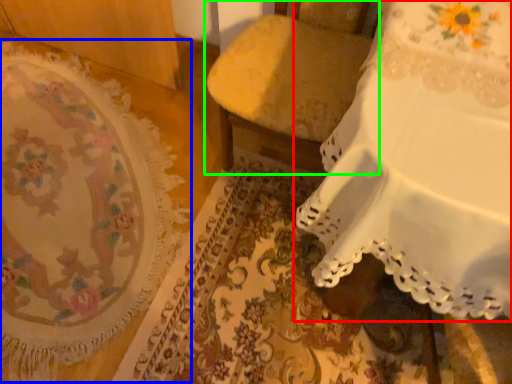
Question: Estimate the real-world distances between objects in this image. Which object is farther from furniture (highlighted by a red box), mat (highlighted by a blue box) or furniture (highlighted by a green box)?

Choices:
 (A) mat
 (B) furniture

Answer: (A)